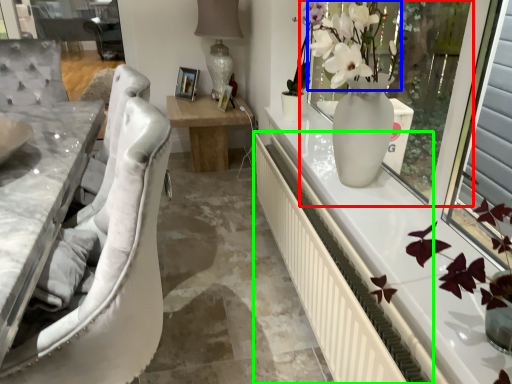
Question: Which is nearer to the window screen (highlighted by a red box)? floral arrangement (highlighted by a blue box) or radiator (highlighted by a green box).

Choices:
 (A) floral arrangement
 (B) radiator

Answer: (A)